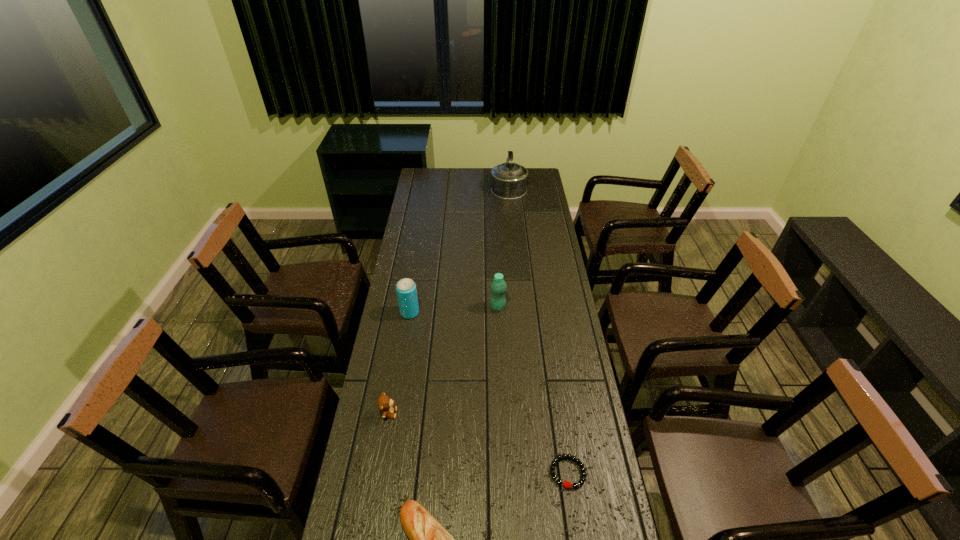
In order to click on object that is at the far right corner in this screenshot , I will do `click(508, 180)`.

The width and height of the screenshot is (960, 540). I want to click on vacant space at the far edge of the desktop, so click(x=450, y=176).

In the image, there is a desktop. At what (x,y) coordinates should I click in order to perform the action: click on vacant space at the left edge. Please return your answer as a coordinate pair (x, y). Looking at the image, I should click on (399, 263).

Locate an element on the screen. The image size is (960, 540). vacant space at the right edge is located at coordinates (596, 506).

At what (x,y) coordinates should I click in order to perform the action: click on blank space at the far left corner of the desktop. Please return your answer as a coordinate pair (x, y). Looking at the image, I should click on (439, 170).

Where is `vacant point located between the fourth tallest object and the soda can`? vacant point located between the fourth tallest object and the soda can is located at coordinates (399, 363).

I want to click on empty space between the kettle and the water bottle, so click(503, 247).

Image resolution: width=960 pixels, height=540 pixels. I want to click on blank region between the farthest object and the shortest object, so click(538, 329).

Locate an element on the screen. free space between the water bottle and the soda can is located at coordinates (454, 310).

This screenshot has height=540, width=960. Identify the location of unoccupied area between the water bottle and the second nearest object. (533, 390).